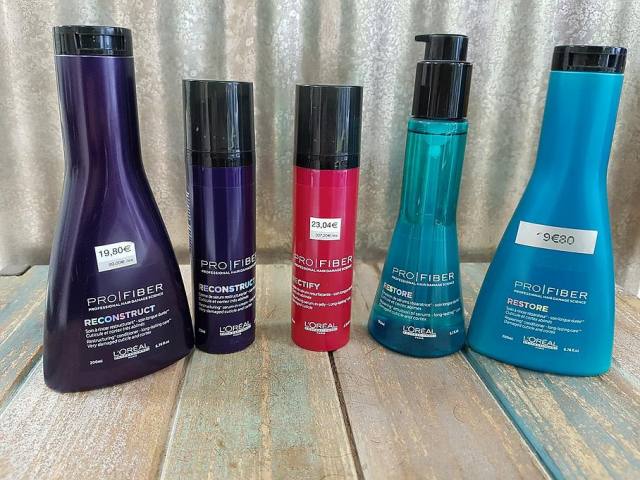
The image size is (640, 480). In order to click on medium pink container with black top in this screenshot , I will do [308, 185], [310, 134], [347, 252], [340, 311].